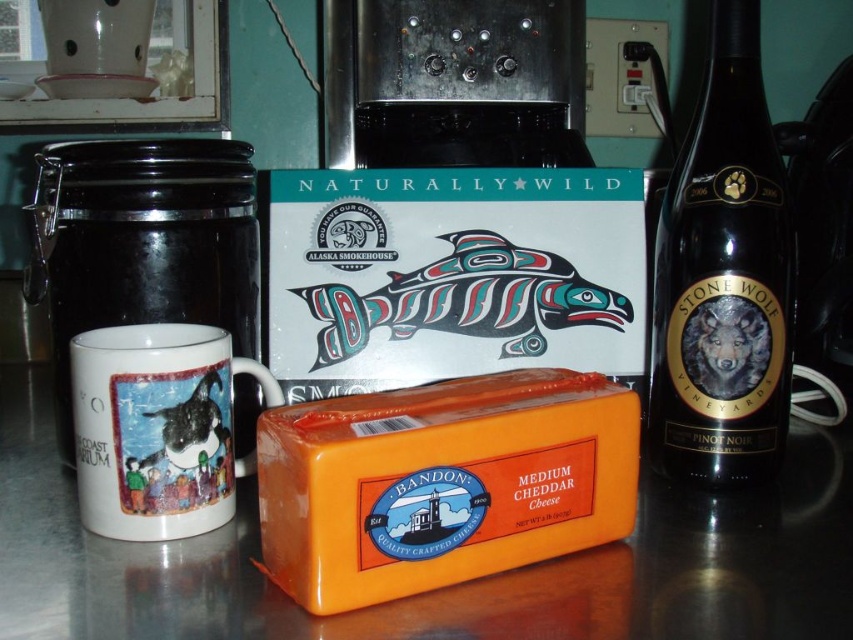
Question: Which point is closer to the camera?

Choices:
 (A) white glossy mug at lower left
 (B) black glass bottle at right
 (C) orange matte cheese at center

Answer: (C)

Question: Is orange plastic cheese at center to the right of multicolored painted fish at center from the viewer's perspective?

Choices:
 (A) no
 (B) yes

Answer: (A)

Question: Can you confirm if black glass bottle at right is positioned below multicolored painted fish at center?

Choices:
 (A) no
 (B) yes

Answer: (A)

Question: Which point is closer to the camera?

Choices:
 (A) white glossy mug at lower left
 (B) white glossy mug at left

Answer: (A)

Question: Which object is farther from the camera taking this photo?

Choices:
 (A) multicolored painted fish at center
 (B) black glass bottle at right

Answer: (A)

Question: Does white glossy mug at lower left appear over multicolored painted fish at center?

Choices:
 (A) no
 (B) yes

Answer: (A)